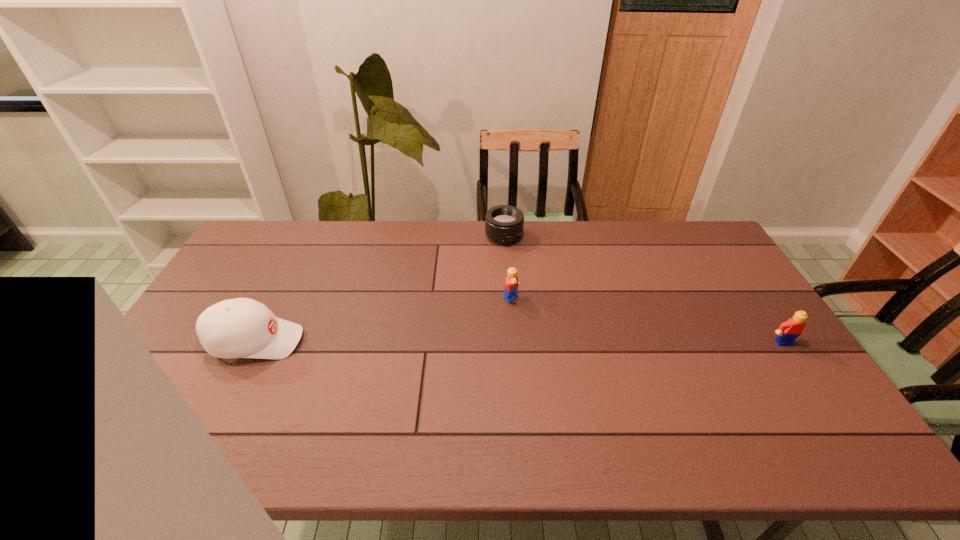
You are a GUI agent. You are given a task and a screenshot of the screen. Output one action in this format:
    pyautogui.click(x=<x>, y=<y>)
    Task: Click on the leftmost object
    
    Given the screenshot: What is the action you would take?
    pyautogui.click(x=235, y=328)

Locate an element on the screen. the right Lego is located at coordinates (788, 331).

At what (x,y) coordinates should I click in order to perform the action: click on the rightmost object. Please return your answer as a coordinate pair (x, y). This screenshot has width=960, height=540. Looking at the image, I should click on (788, 331).

Where is `the third nearest object`? the third nearest object is located at coordinates [511, 283].

Identify the location of the farther Lego. The width and height of the screenshot is (960, 540). (511, 283).

Where is `the farthest object`? the farthest object is located at coordinates (504, 224).

The height and width of the screenshot is (540, 960). In order to click on the shortest object in this screenshot , I will do `click(504, 224)`.

I want to click on vacant space positioned 0.100m on the front-facing side of the baseball cap, so tap(337, 341).

Identify the location of free region located on the face of the rightmost object. This screenshot has width=960, height=540. (819, 395).

The height and width of the screenshot is (540, 960). Identify the location of vacant space positioned on the face of the farther Lego. (627, 378).